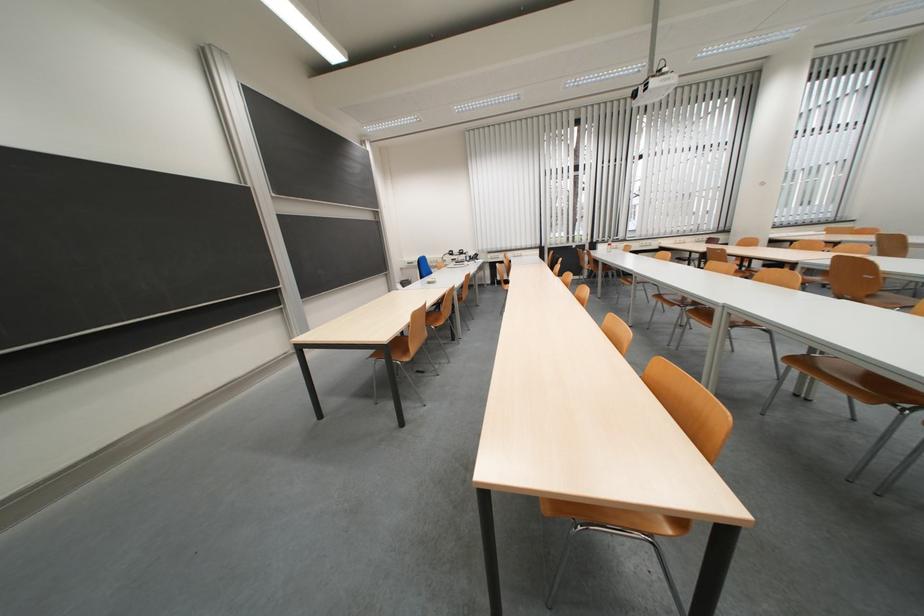
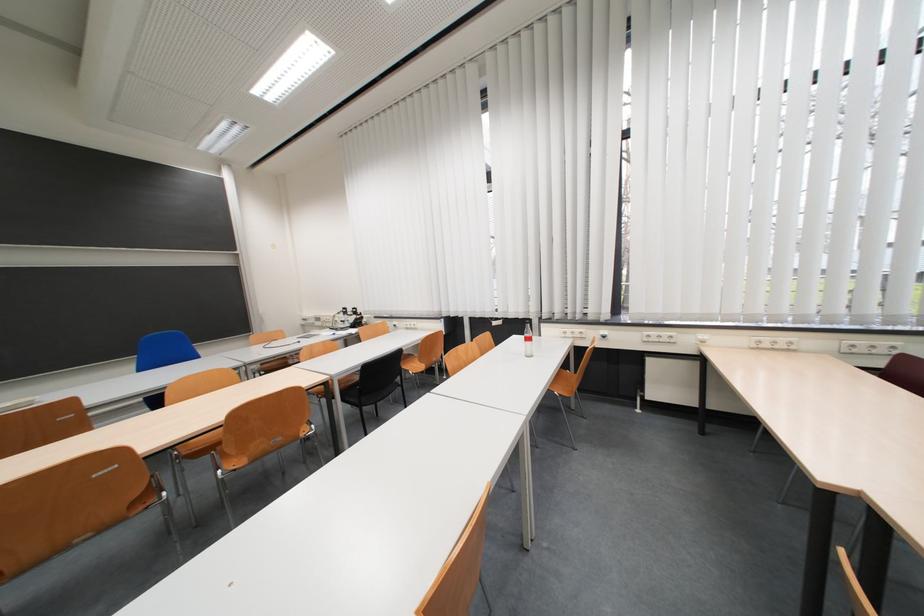
In the second image, find the point that corresponds to (x=463, y=257) in the first image.

(357, 315)